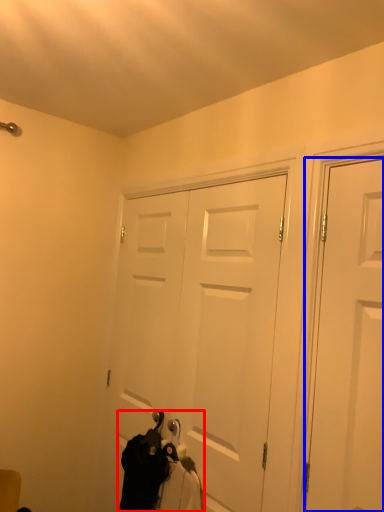
Question: Which object appears closest to the camera in this image, laundry (highlighted by a red box) or door (highlighted by a blue box)?

Choices:
 (A) laundry
 (B) door

Answer: (B)